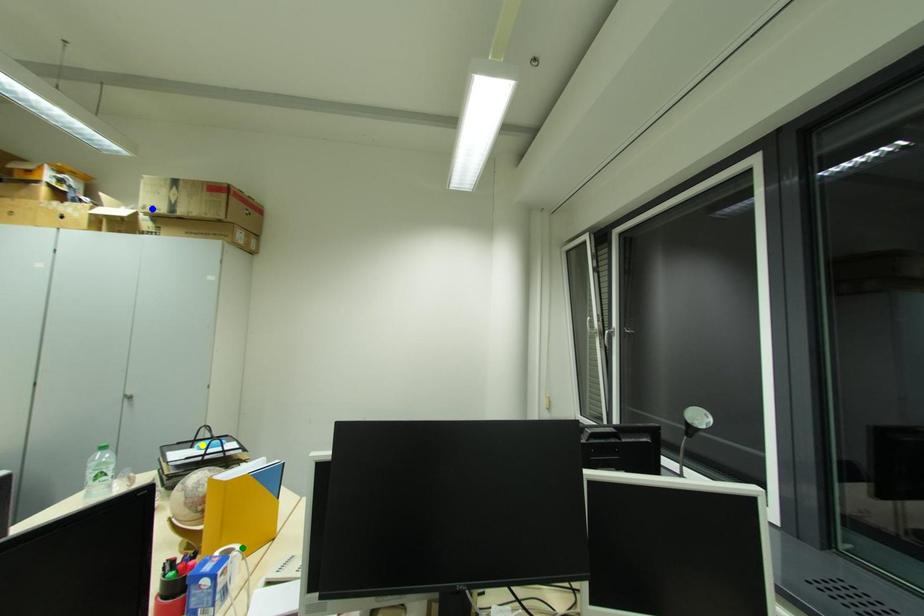
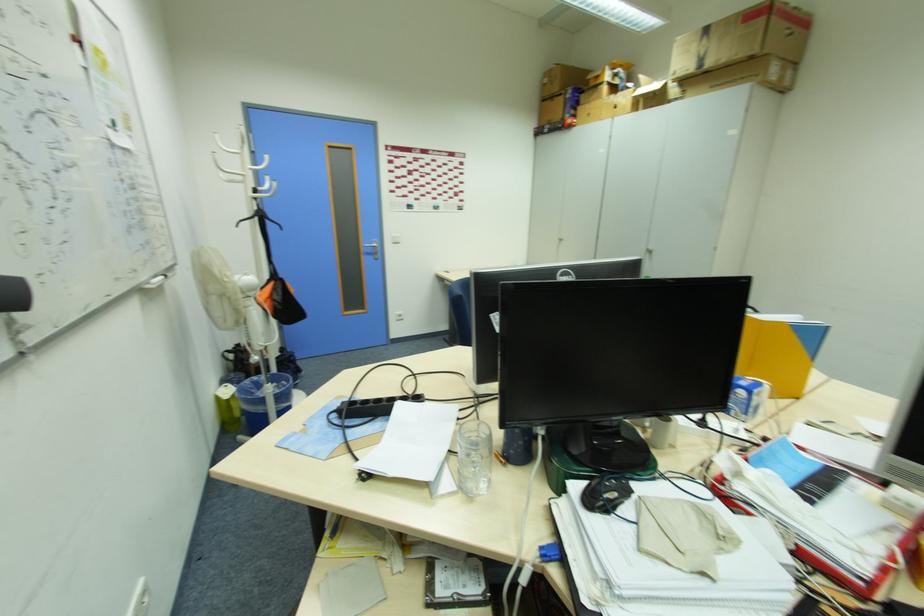
I am providing you with two images of the same scene from different viewpoints. Three points are marked in image1. Which point corresponds to a part or object that is occluded in image2?In image1, three points are marked. Which of them correspond to a part or object that is occluded in image2?Among the three points shown in image1, which one corresponds to a part or object that is no longer visible due to occlusion in image2?

yellow point